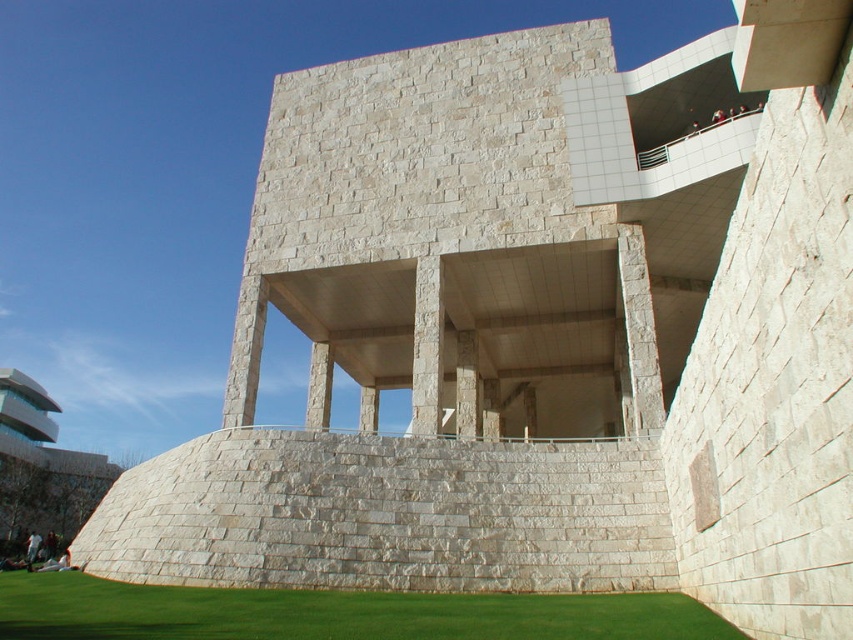
You are standing at the base of the natural stone column at center and want to walk towards the green grass at lower center. Is the path between them wide enough for a wheelchair to pass through comfortably?

The green grass at lower center might be wider than natural stone column at center, so the path between them could potentially accommodate a wheelchair, but the exact width isn